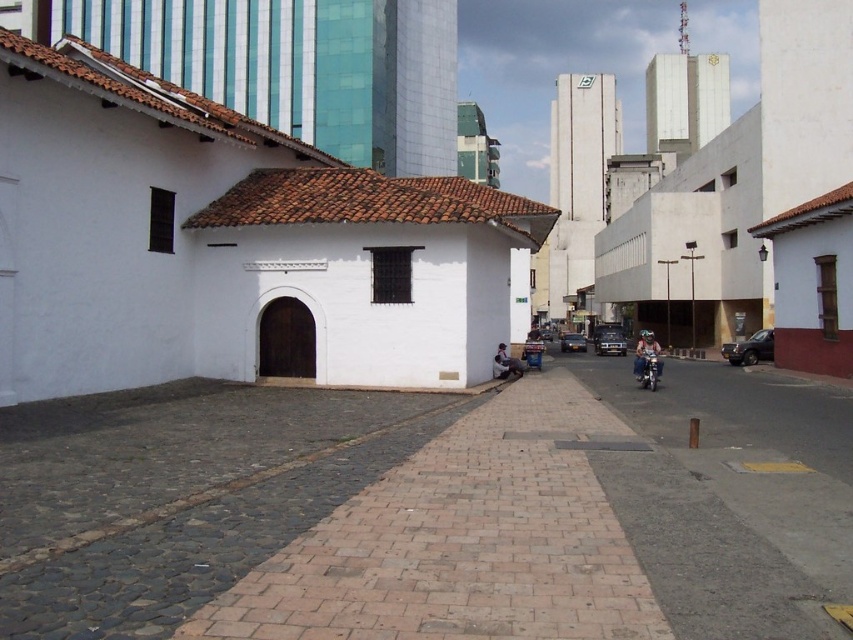
Between dark skin person at center and dark brown leather jacket at center, which one appears on the right side from the viewer's perspective?

From the viewer's perspective, dark brown leather jacket at center appears more on the right side.

Between dark skin person at center and dark brown leather jacket at center, which one has less height?

Standing shorter between the two is dark skin person at center.

Who is more forward, (523, 369) or (537, 336)?

Point (523, 369) is more forward.

I want to click on dark skin person at center, so click(508, 360).

Which of these two, dark skin person at center or metallic silver sedan at center, stands shorter?

With less height is dark skin person at center.

Is point (505, 348) in front of point (541, 333)?

Yes, point (505, 348) is in front of point (541, 333).

Locate an element on the screen. dark skin person at center is located at coordinates (508, 360).

Does shiny blue motorcycle at center-right appear over shiny silver sedan at center?

Correct, shiny blue motorcycle at center-right is located above shiny silver sedan at center.

Is shiny blue motorcycle at center-right positioned at the back of shiny silver sedan at center?

No.

Does point (653, 356) come behind point (573, 348)?

No, it is in front of (573, 348).

Locate an element on the screen. The height and width of the screenshot is (640, 853). shiny blue motorcycle at center-right is located at coordinates (648, 369).